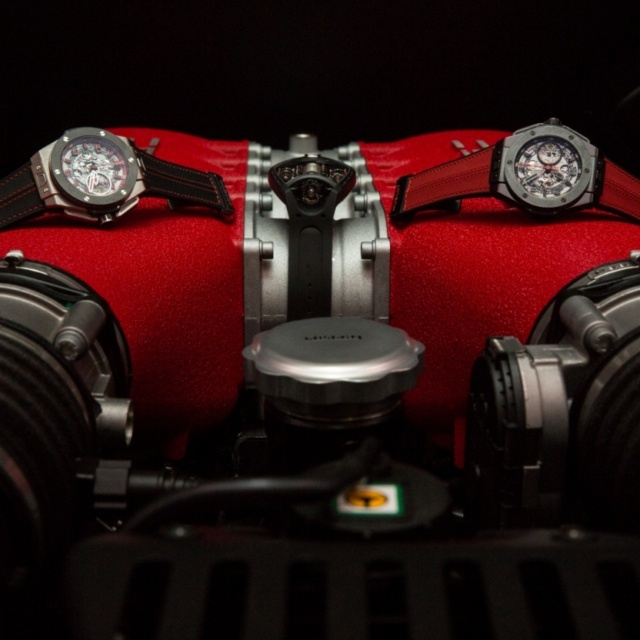
You are a photographer trying to capture the two items in the engine bay. Since you want to ensure both the leather strap at upper center and the satin silver watch at upper right are fully visible in the frame, which item should you focus on first to avoid cropping?

The leather strap at upper center is taller than the satin silver watch at upper right, so you should focus on the leather strap at upper center first to ensure it fits entirely in the frame before adjusting for the smaller watch.

You are a car mechanic working on the engine bay of a luxury sports car. You need to place a tool that is 20 inches long between the leather strap at upper center and the matte black watch at left. Is there enough space to fit the tool without moving either object?

The leather strap at upper center is 19.00 inches from the matte black watch at left. Since the tool is 20 inches long, it is longer than the available space, so it won

You are a photographer taking a close look at the engine bay of a luxury sports car. You notice two items on the red engine cover surface. One is the black leather strap at left and the other is the matte black watch at left. Which item is positioned closer to you?

The black leather strap at left is closer to the viewer than the matte black watch at left.